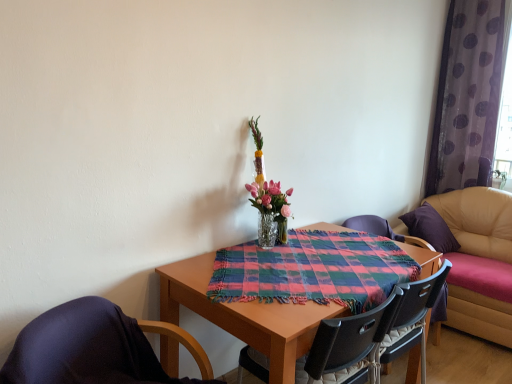
Question: Is clear glass vase at center next to purple sheer curtain at right and touching it?

Choices:
 (A) no
 (B) yes

Answer: (A)

Question: Considering the relative positions of clear glass vase at center and purple sheer curtain at right in the image provided, is clear glass vase at center to the left of purple sheer curtain at right from the viewer's perspective?

Choices:
 (A) yes
 (B) no

Answer: (A)

Question: Does clear glass vase at center have a larger size compared to purple sheer curtain at right?

Choices:
 (A) no
 (B) yes

Answer: (A)

Question: Is clear glass vase at center taller than purple sheer curtain at right?

Choices:
 (A) yes
 (B) no

Answer: (B)

Question: Can you confirm if clear glass vase at center is wider than purple sheer curtain at right?

Choices:
 (A) yes
 (B) no

Answer: (A)

Question: Based on their positions, is black plastic chair at center, which is the 2th chair in right-to-left order, located to the left or right of leather couch at right?

Choices:
 (A) left
 (B) right

Answer: (A)

Question: Is black plastic chair at center, which is the 2th chair in right-to-left order, bigger or smaller than leather couch at right?

Choices:
 (A) small
 (B) big

Answer: (A)

Question: From the image's perspective, relative to leather couch at right, is black plastic chair at center, which is the second chair from front to back, above or below?

Choices:
 (A) below
 (B) above

Answer: (A)

Question: From a real-world perspective, is black plastic chair at center, which is the 2th chair in back-to-front order, above or below leather couch at right?

Choices:
 (A) above
 (B) below

Answer: (B)

Question: From the image's perspective, is purple sheer curtain at right above or below clear glass vase at center?

Choices:
 (A) below
 (B) above

Answer: (B)

Question: Visually, is purple sheer curtain at right positioned to the left or to the right of clear glass vase at center?

Choices:
 (A) left
 (B) right

Answer: (B)

Question: Considering their positions, is purple sheer curtain at right located in front of or behind clear glass vase at center?

Choices:
 (A) behind
 (B) front

Answer: (A)

Question: Is purple sheer curtain at right wider or thinner than clear glass vase at center?

Choices:
 (A) thin
 (B) wide

Answer: (A)

Question: Is point (373, 226) positioned closer to the camera than point (370, 304)?

Choices:
 (A) farther
 (B) closer

Answer: (A)

Question: From their relative heights in the image, would you say black plastic chair at center, placed as the first chair when sorted from right to left, is taller or shorter than plaid fabric at center?

Choices:
 (A) tall
 (B) short

Answer: (A)